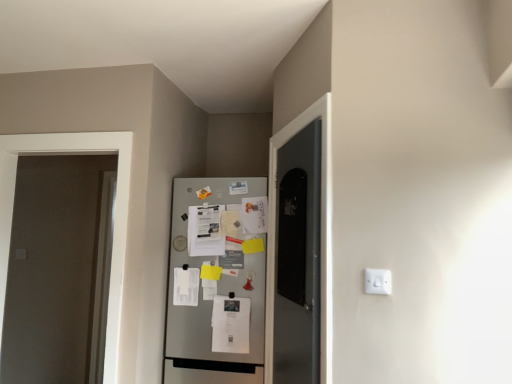
Question: Is metallic silver refrigerator at center smaller than white matte door at left?

Choices:
 (A) no
 (B) yes

Answer: (A)

Question: Does metallic silver refrigerator at center have a lesser height compared to white matte door at left?

Choices:
 (A) no
 (B) yes

Answer: (B)

Question: From a real-world perspective, is metallic silver refrigerator at center on white matte door at left?

Choices:
 (A) no
 (B) yes

Answer: (A)

Question: Is the depth of metallic silver refrigerator at center greater than that of white matte door at left?

Choices:
 (A) yes
 (B) no

Answer: (A)

Question: Does metallic silver refrigerator at center appear on the right side of white matte door at left?

Choices:
 (A) no
 (B) yes

Answer: (B)

Question: From the image's perspective, does metallic silver refrigerator at center appear lower than white matte door at left?

Choices:
 (A) yes
 (B) no

Answer: (A)

Question: Can you confirm if white plastic electric outlet at center right is bigger than white matte door at left?

Choices:
 (A) no
 (B) yes

Answer: (A)

Question: From the image's perspective, is white plastic electric outlet at center right on white matte door at left?

Choices:
 (A) yes
 (B) no

Answer: (A)

Question: Can you confirm if white plastic electric outlet at center right is shorter than white matte door at left?

Choices:
 (A) yes
 (B) no

Answer: (A)

Question: Is white plastic electric outlet at center right facing away from white matte door at left?

Choices:
 (A) yes
 (B) no

Answer: (B)

Question: Is white plastic electric outlet at center right positioned behind white matte door at left?

Choices:
 (A) no
 (B) yes

Answer: (A)

Question: Does white plastic electric outlet at center right have a greater width compared to white matte door at left?

Choices:
 (A) no
 (B) yes

Answer: (A)

Question: Is white matte door at left to the left of white plastic electric outlet at center right from the viewer's perspective?

Choices:
 (A) no
 (B) yes

Answer: (B)